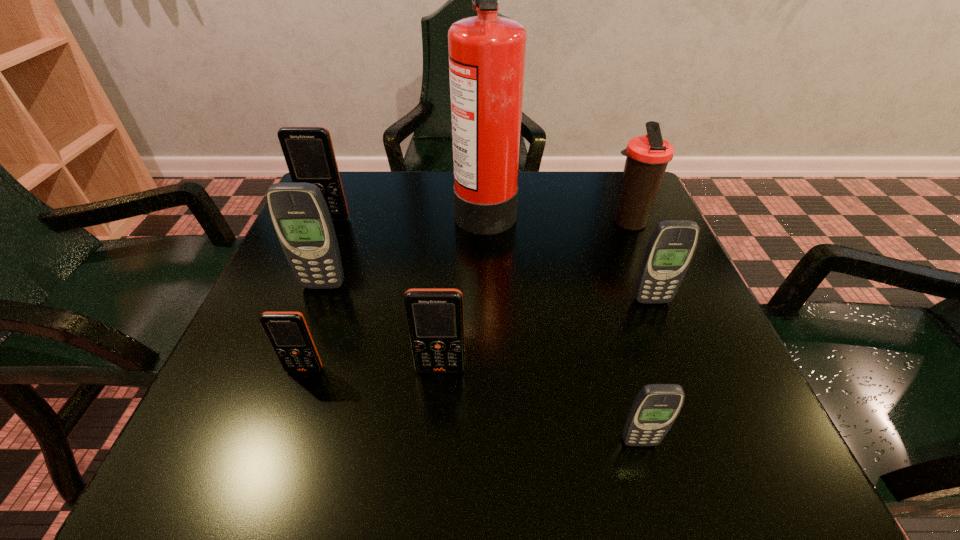
The image size is (960, 540). Find the location of `object located at the near right corner`. object located at the near right corner is located at coordinates (655, 408).

In the image, there is a desktop. What are the coordinates of `blank space at the far edge` in the screenshot? It's located at (568, 195).

This screenshot has width=960, height=540. What are the coordinates of `free spot at the near edge of the desktop` in the screenshot? It's located at (482, 454).

Where is `vacant space at the left edge of the desktop`? vacant space at the left edge of the desktop is located at coordinates (276, 304).

You are a GUI agent. You are given a task and a screenshot of the screen. Output one action in this format:
    pyautogui.click(x=<x>, y=<y>)
    Task: Click on the vacant area at the right edge of the desktop
    Image resolution: width=960 pixels, height=540 pixels.
    Given the screenshot: What is the action you would take?
    pyautogui.click(x=685, y=395)

Find the location of a particular element. vacant space at the far left corner is located at coordinates (356, 190).

Where is `free space at the near left corner of the desktop`? This screenshot has width=960, height=540. free space at the near left corner of the desktop is located at coordinates (286, 460).

The height and width of the screenshot is (540, 960). Find the location of `empty location between the leftmost gray cellular telephone and the fifth cellular telephone from left to right`. empty location between the leftmost gray cellular telephone and the fifth cellular telephone from left to right is located at coordinates (481, 363).

The width and height of the screenshot is (960, 540). Identify the location of vacant space that's between the smallest gray cellular telephone and the smallest orange cellular telephone. (472, 406).

Where is `empty space between the red fire extinguisher and the brown thermos bottle`? The height and width of the screenshot is (540, 960). empty space between the red fire extinguisher and the brown thermos bottle is located at coordinates pyautogui.click(x=557, y=215).